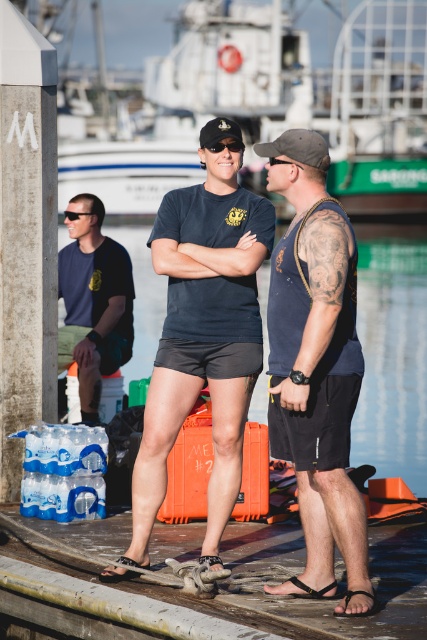
You are standing on the dock and want to place both the wooden at center and the camouflage fabric baseball cap at center on a shelf. The shelf can only hold items with a width of 10 cm or less. Which item is more likely to fit on the shelf?

The wooden at center has a lesser width compared to camouflage fabric baseball cap at center, so the wooden at center is more likely to fit on the shelf since it is narrower than the camouflage fabric baseball cap at center.